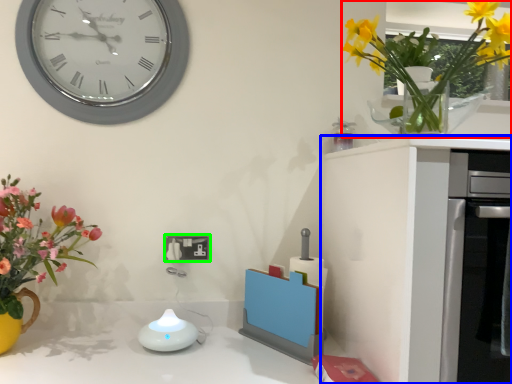
Question: Which object is the closest to the floral arrangement (highlighted by a red box)? Choose among these: cabinetry (highlighted by a blue box) or electric outlet (highlighted by a green box).

Choices:
 (A) cabinetry
 (B) electric outlet

Answer: (A)